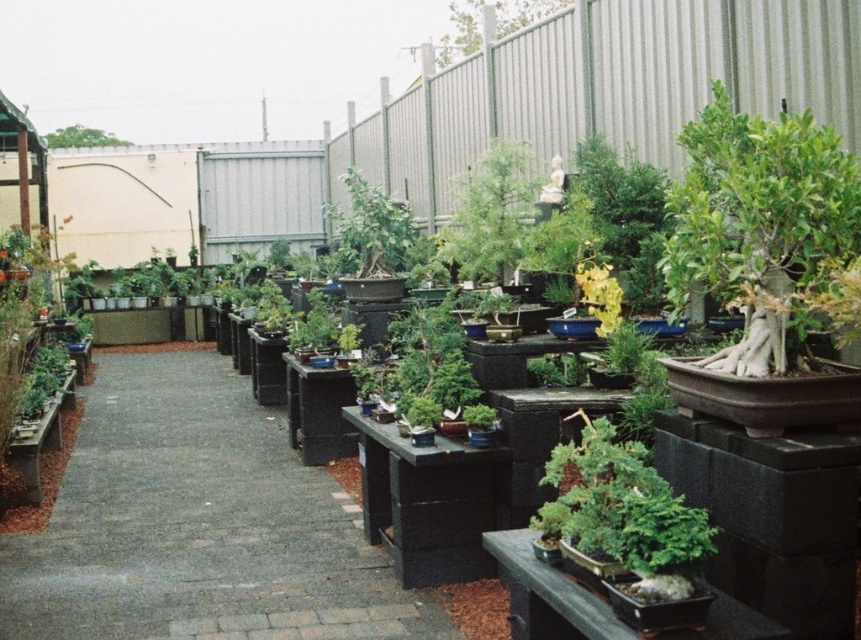
You are a customer at the nursery and want to buy both the green matte bonsai tree at center and the green leafy tree at upper left. You need to know which one is closer to the fence. Can you tell me which one is closer?

The green leafy tree at upper left is closer to the fence because the green matte bonsai tree at center is located below it, meaning the bonsai is farther from the fence than the leafy tree.